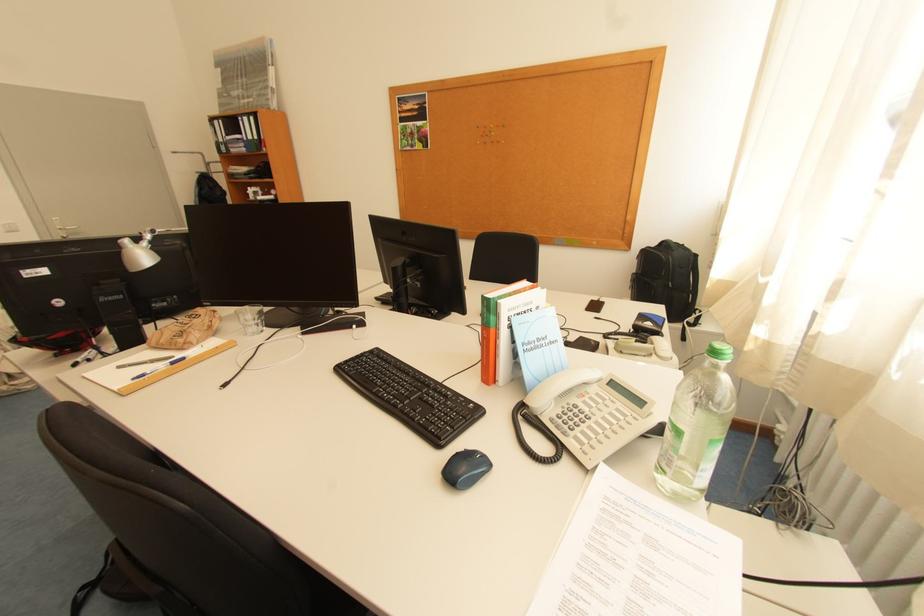
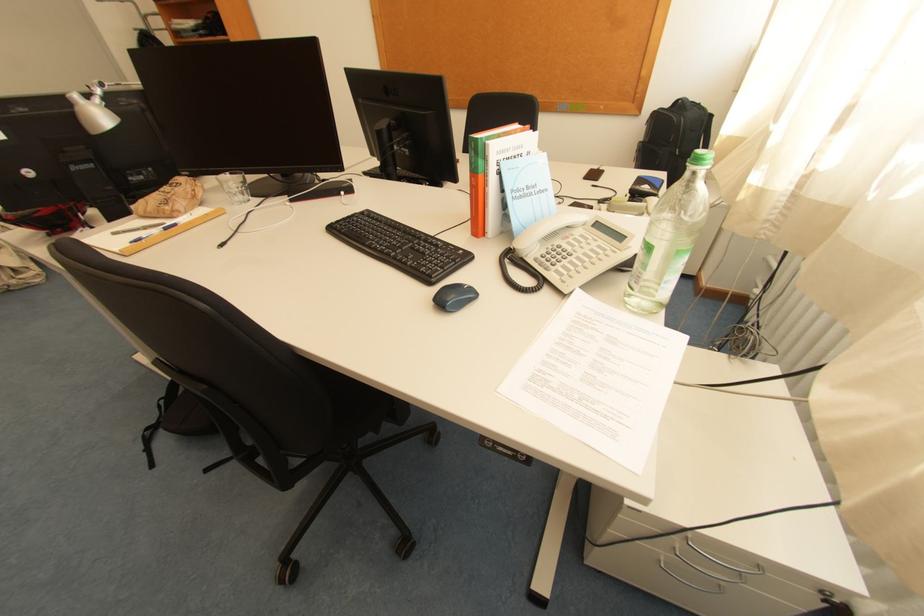
Locate, in the second image, the point that corresponds to point 492,360 in the first image.

(482, 211)